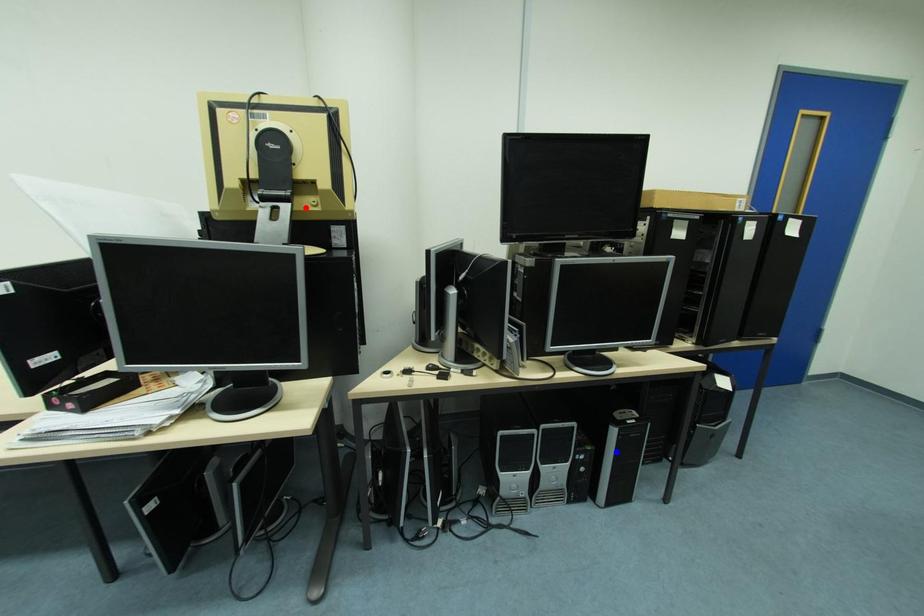
Question: In the image, two points are highlighted. Which point is nearer to the camera? Reply with the corresponding letter.

Choices:
 (A) blue point
 (B) red point

Answer: (B)